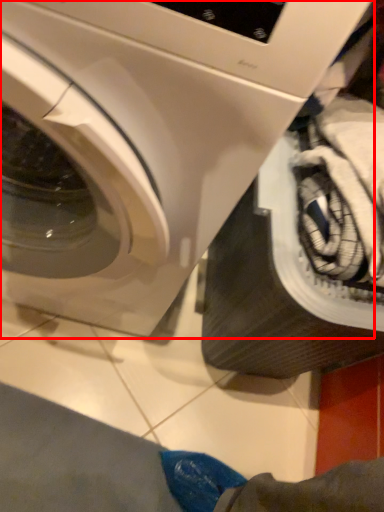
Question: Considering the relative positions of washing machine (annotated by the red box) and tire in the image provided, where is washing machine (annotated by the red box) located with respect to the staircase?

Choices:
 (A) right
 (B) left

Answer: (B)